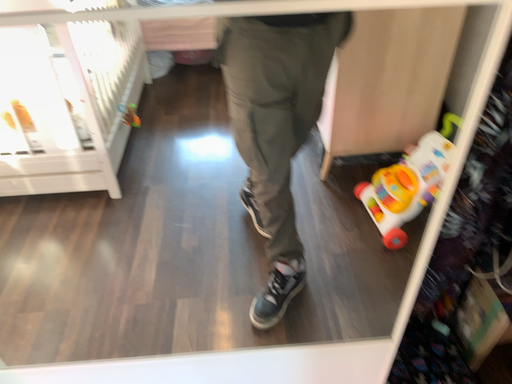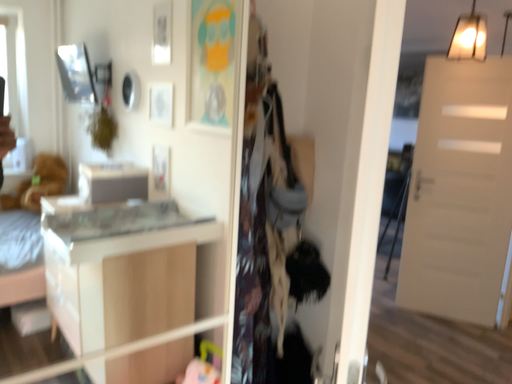
Question: Which way did the camera rotate in the video?

Choices:
 (A) rotated left
 (B) rotated right

Answer: (B)